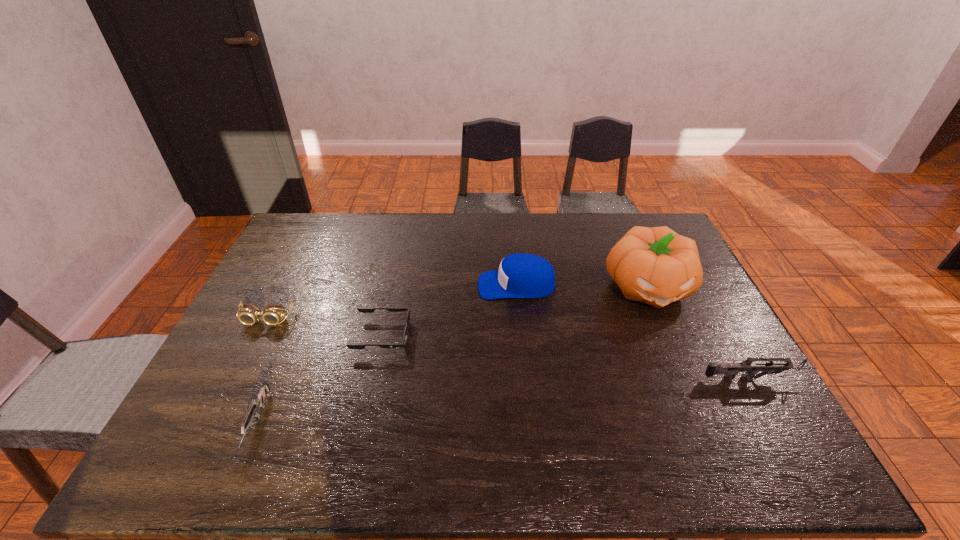
Locate an element on the screen. The width and height of the screenshot is (960, 540). the left gun is located at coordinates (259, 401).

Locate an element on the screen. The height and width of the screenshot is (540, 960). the nearer gun is located at coordinates (259, 401).

Image resolution: width=960 pixels, height=540 pixels. I want to click on the fifth farthest object, so click(730, 370).

The image size is (960, 540). What are the coordinates of `the right gun` in the screenshot? It's located at (730, 370).

Identify the location of the shortest object. (361, 309).

Where is `sunglasses`? This screenshot has width=960, height=540. sunglasses is located at coordinates (361, 309).

This screenshot has width=960, height=540. Identify the location of baseball cap. (520, 275).

In order to click on the second tallest object in this screenshot , I will do `click(520, 275)`.

I want to click on pumpkin, so click(657, 266).

Find the location of a particular element. This screenshot has height=540, width=960. the leftmost object is located at coordinates (249, 314).